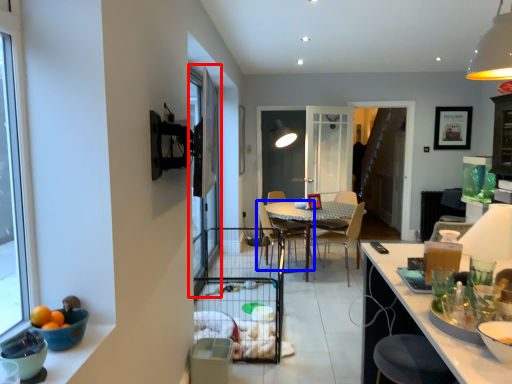
Question: Among these objects, which one is farthest to the camera, screen door (highlighted by a red box) or chair (highlighted by a blue box)?

Choices:
 (A) screen door
 (B) chair

Answer: (B)